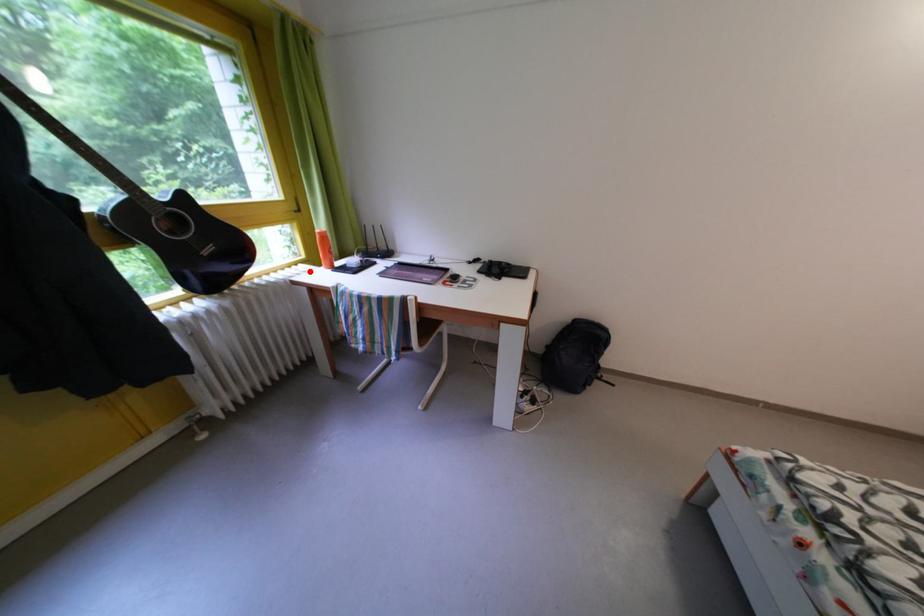
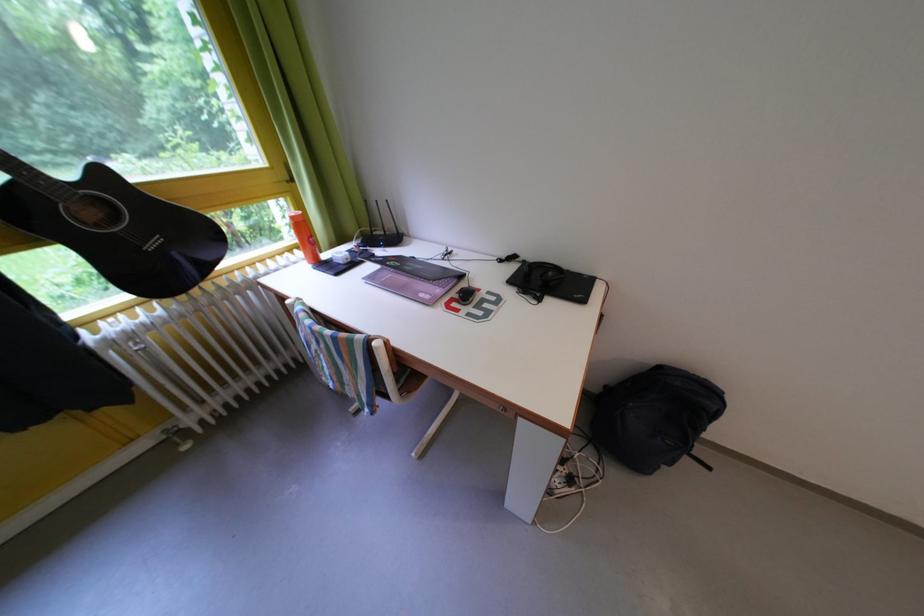
The point at the highlighted location is marked in the first image. Where is the corresponding point in the second image?

(305, 257)